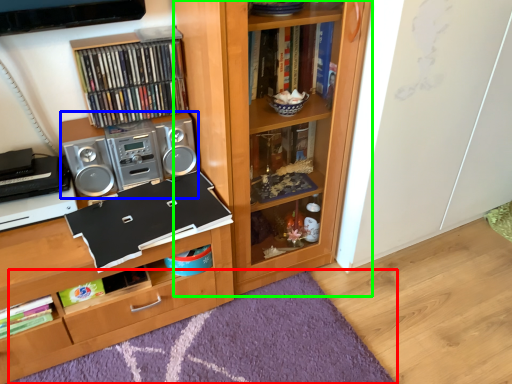
Question: Which object is the farthest from mat (highlighted by a red box)? Choose among these: stereo (highlighted by a blue box) or bookcase (highlighted by a green box).

Choices:
 (A) stereo
 (B) bookcase

Answer: (A)